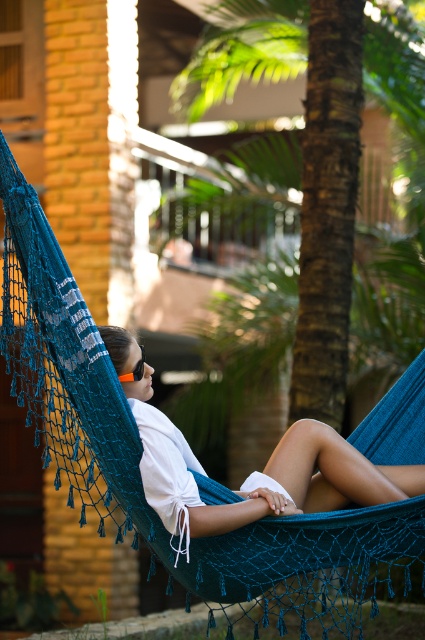
Question: Which of the following is the farthest from the observer?

Choices:
 (A) 325,348
 (B) 130,368

Answer: (A)

Question: Is green textured palm tree at center to the right of white cotton shirt at center from the viewer's perspective?

Choices:
 (A) yes
 (B) no

Answer: (B)

Question: In this image, where is green textured palm tree at center located relative to white cotton shirt at center?

Choices:
 (A) below
 (B) above

Answer: (B)

Question: Which of the following is the farthest from the observer?

Choices:
 (A) (302, 496)
 (B) (141, 362)
 (C) (294, 384)

Answer: (C)

Question: Which of the following is the closest to the observer?

Choices:
 (A) (138, 378)
 (B) (371, 480)
 (C) (289, 44)

Answer: (A)

Question: Does green textured palm tree at center appear on the right side of white cotton shirt at center?

Choices:
 (A) no
 (B) yes

Answer: (A)